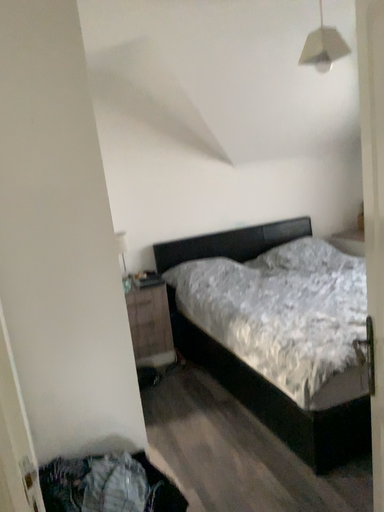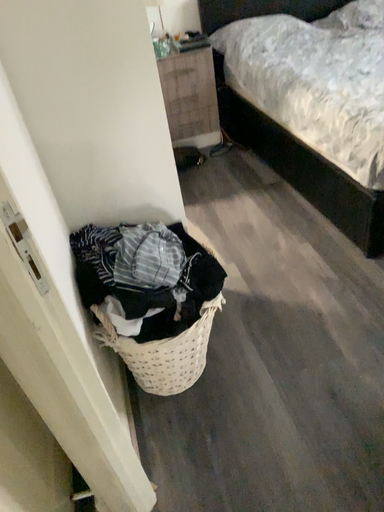
Question: Which way did the camera rotate in the video?

Choices:
 (A) rotated downward
 (B) rotated upward

Answer: (A)